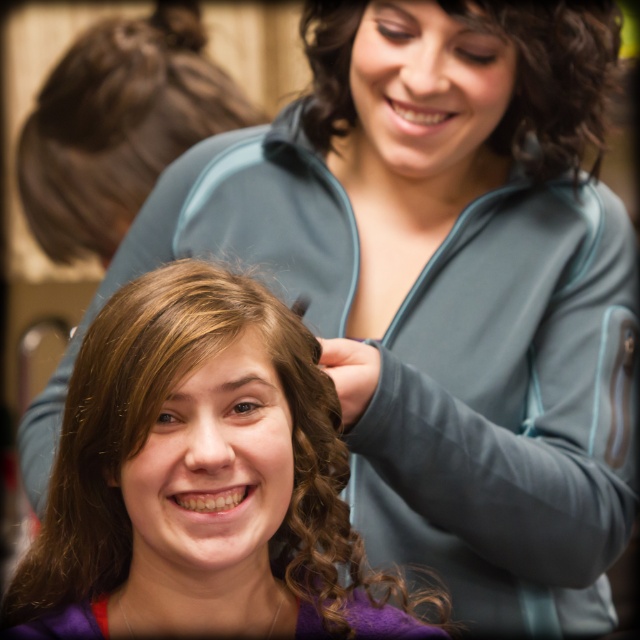
Does smooth brown hair at center appear on the right side of brown hair at upper left?

Correct, you'll find smooth brown hair at center to the right of brown hair at upper left.

Is smooth brown hair at center behind brown hair at upper left?

No, smooth brown hair at center is closer to the viewer.

Who is more forward, (358,577) or (100,177)?

Positioned in front is point (358,577).

Where is `smooth brown hair at center`? This screenshot has width=640, height=640. smooth brown hair at center is located at coordinates (200, 480).

Is smooth brown hair at center bigger than curly brown hair at upper center?

Yes.

Between point (60, 580) and point (330, 115), which one is positioned behind?

The point (330, 115) is behind.

Image resolution: width=640 pixels, height=640 pixels. I want to click on smooth brown hair at center, so click(x=200, y=480).

Locate an element on the screen. smooth brown hair at center is located at coordinates (200, 480).

Based on the photo, does brown hair at upper left have a greater height compared to curly brown hair at upper center?

Indeed, brown hair at upper left has a greater height compared to curly brown hair at upper center.

Does brown hair at upper left appear on the right side of curly brown hair at upper center?

Incorrect, brown hair at upper left is not on the right side of curly brown hair at upper center.

Where is `brown hair at upper left`? brown hair at upper left is located at coordinates (118, 125).